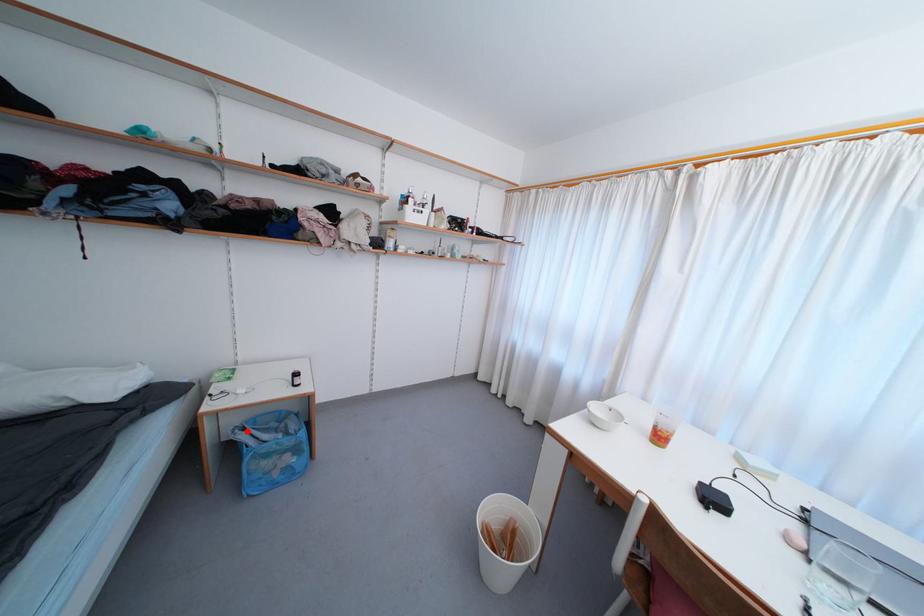
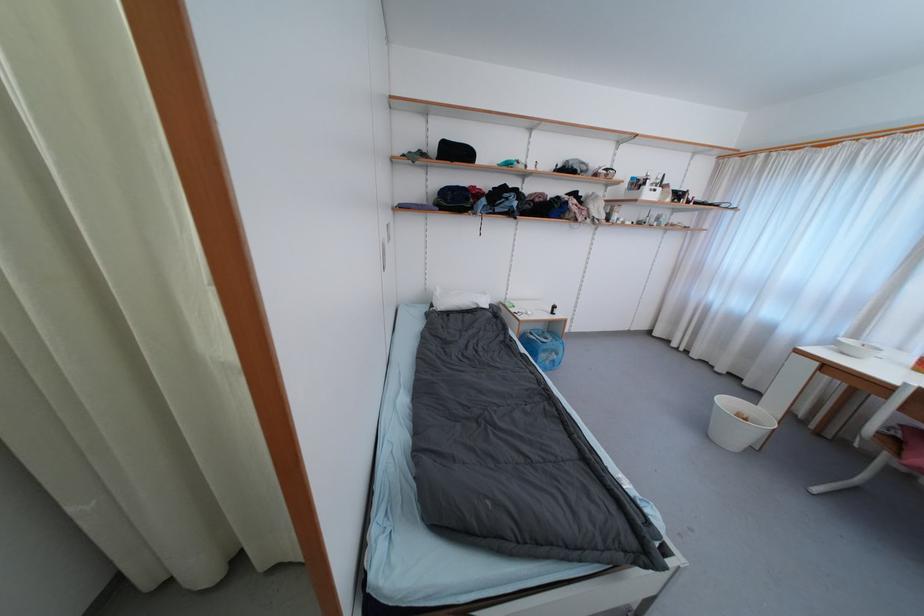
The point at the highlighted location is marked in the first image. Where is the corresponding point in the second image?

(535, 336)